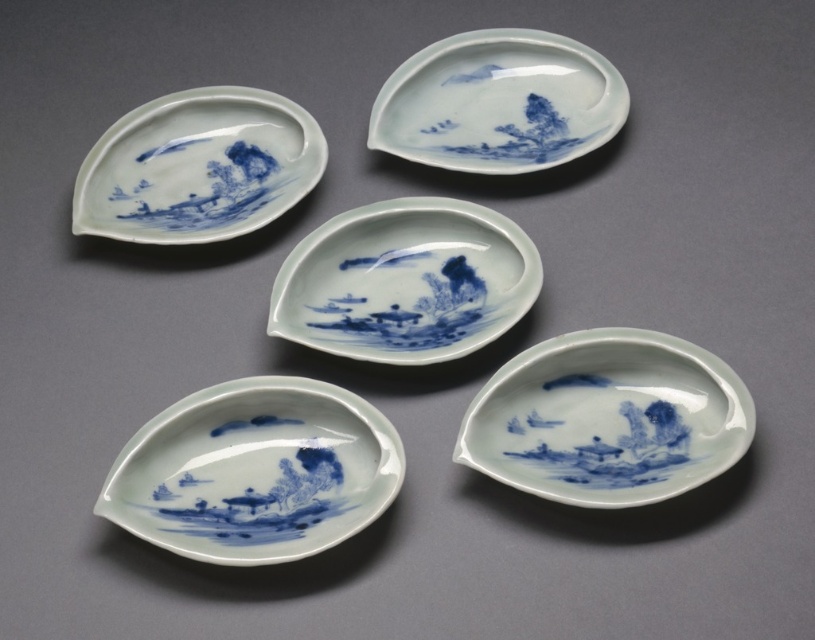
You are arranging dishes on a shelf and need to know the relative positions of the blue porcelain plate at bottom right and the blue porcelain plate at upper left. Which one is placed lower on the shelf?

The blue porcelain plate at bottom right is positioned under the blue porcelain plate at upper left, so it is placed lower on the shelf.

You are an art conservator examining the arrangement of dishes in the image. You need to locate the blue porcelain saucer at lower left to assess its condition. According to the coordinates provided, what are its exact coordinates?

The blue porcelain saucer at lower left is located at coordinates point (254,472).

You are an art curator arranging an exhibition. You have two blue porcelain plates to display. The blue porcelain plate at bottom right and the blue porcelain plate at upper center. Which plate should you choose if you want to showcase a larger piece in terms of width?

The blue porcelain plate at upper center has a greater width compared to the blue porcelain plate at bottom right, so you should choose the blue porcelain plate at upper center to showcase a larger piece in terms of width.